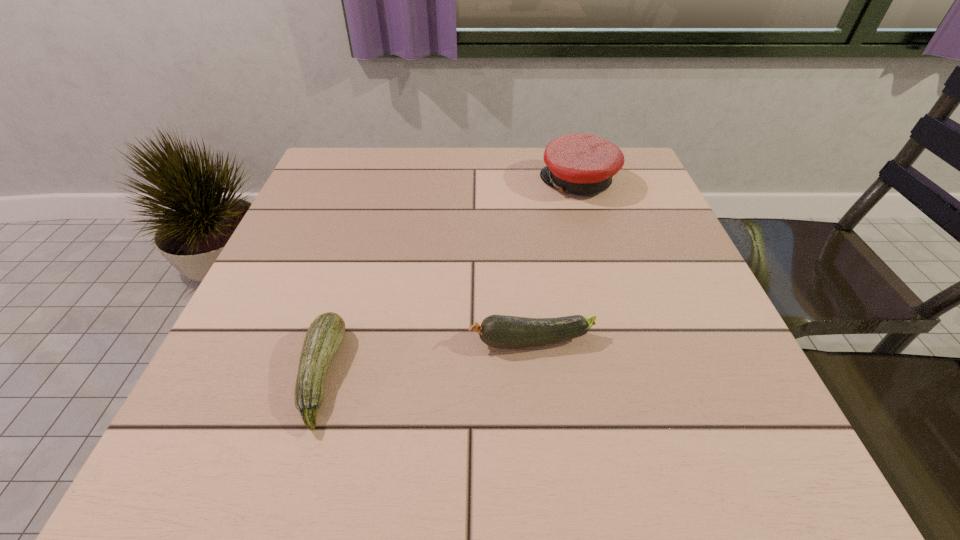
This screenshot has height=540, width=960. Find the location of `the farthest object`. the farthest object is located at coordinates (581, 164).

What are the coordinates of `cap` in the screenshot? It's located at (581, 164).

Find the location of a particular element. This screenshot has height=540, width=960. the leftmost object is located at coordinates (325, 334).

You are a GUI agent. You are given a task and a screenshot of the screen. Output one action in this format:
    pyautogui.click(x=<x>, y=<y>)
    Task: Click on the right zucchini
    This screenshot has height=540, width=960.
    Given the screenshot: What is the action you would take?
    pyautogui.click(x=500, y=331)

Identify the location of vacant space located at the front of the farthest object where the visor is located. (447, 183).

The image size is (960, 540). Identify the location of free space located at the front of the farthest object where the visor is located. (510, 183).

You are a GUI agent. You are given a task and a screenshot of the screen. Output one action in this format:
    pyautogui.click(x=<x>, y=<y>)
    Task: Click on the vacant space situated 0.060m at the front of the farthest object where the visor is located
    This screenshot has width=960, height=540.
    Given the screenshot: What is the action you would take?
    pyautogui.click(x=517, y=183)

Identify the location of blank area located 0.270m at the stem end of the left zucchini. The height and width of the screenshot is (540, 960). (505, 375).

The height and width of the screenshot is (540, 960). Identify the location of free space located at the blossom end of the right zucchini. (372, 341).

Find the location of a particular element. This screenshot has width=960, height=540. free space located 0.310m at the blossom end of the right zucchini is located at coordinates (291, 341).